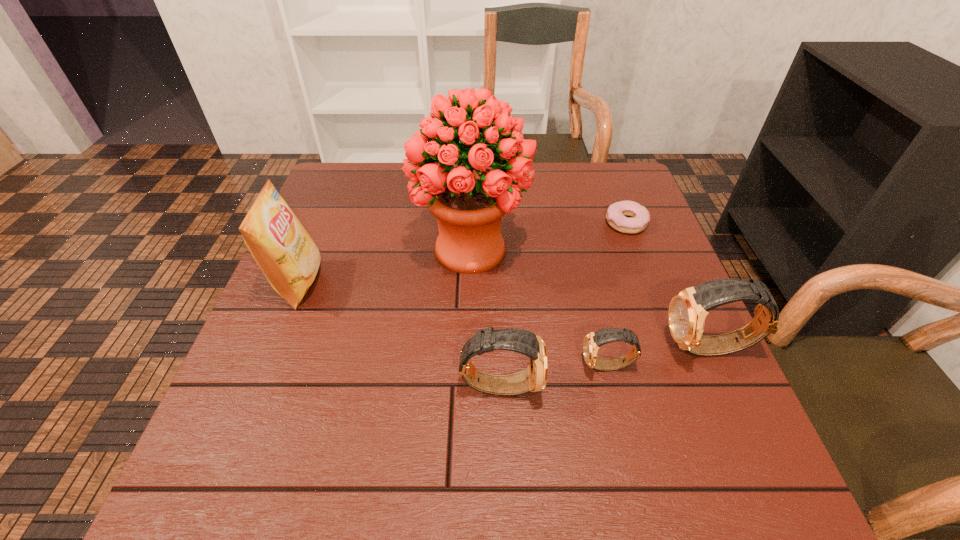
This screenshot has height=540, width=960. I want to click on the second tallest watch, so click(534, 378).

The height and width of the screenshot is (540, 960). In order to click on the third shortest object in this screenshot , I will do `click(534, 378)`.

Locate an element on the screen. Image resolution: width=960 pixels, height=540 pixels. the shortest watch is located at coordinates (593, 340).

The image size is (960, 540). I want to click on the third object from right to left, so click(x=593, y=340).

Where is `the rightmost watch`? the rightmost watch is located at coordinates (688, 309).

Find the location of a particular element. the tallest object is located at coordinates (469, 201).

The width and height of the screenshot is (960, 540). In order to click on the leftmost object in this screenshot , I will do `click(288, 257)`.

Image resolution: width=960 pixels, height=540 pixels. Identify the location of crisp (potato chip). (288, 257).

Identify the location of doughnut. This screenshot has width=960, height=540. (616, 213).

Identify the location of vacant position located 0.140m on the face of the second shortest watch. (615, 385).